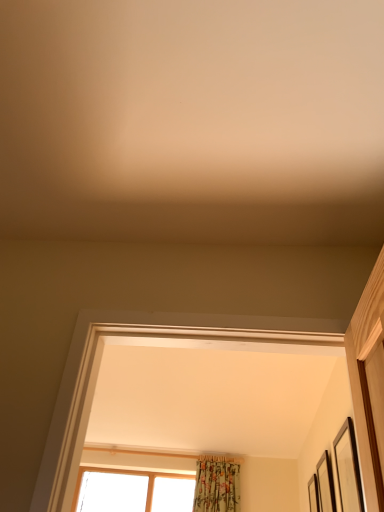
Question: Does wooden picture frame at right, the 2th picture frame when ordered from front to back, have a lesser width compared to black matte picture frame at right, the 3th picture frame in the right-to-left sequence?

Choices:
 (A) no
 (B) yes

Answer: (A)

Question: Can you confirm if wooden picture frame at right, acting as the second picture frame starting from the back, is wider than black matte picture frame at right, which is counted as the third picture frame, starting from the back?

Choices:
 (A) yes
 (B) no

Answer: (A)

Question: Could you tell me if wooden picture frame at right, placed as the 2th picture frame when sorted from left to right, is turned towards black matte picture frame at right, which is counted as the third picture frame, starting from the back?

Choices:
 (A) no
 (B) yes

Answer: (A)

Question: Considering the relative positions of wooden picture frame at right, marked as the 2th picture frame in a right-to-left arrangement, and black matte picture frame at right, the 3th picture frame in the right-to-left sequence, in the image provided, is wooden picture frame at right, marked as the 2th picture frame in a right-to-left arrangement, to the right of black matte picture frame at right, the 3th picture frame in the right-to-left sequence, from the viewer's perspective?

Choices:
 (A) yes
 (B) no

Answer: (A)

Question: Is wooden picture frame at right, placed as the 2th picture frame when sorted from left to right, next to black matte picture frame at right, the first picture frame when ordered from left to right, and touching it?

Choices:
 (A) no
 (B) yes

Answer: (A)

Question: From a real-world perspective, is wooden picture frame at right, marked as the 2th picture frame in a right-to-left arrangement, positioned over black matte picture frame at right, the first picture frame when ordered from left to right, based on gravity?

Choices:
 (A) no
 (B) yes

Answer: (B)

Question: From the image's perspective, is wooden picture frame at right, marked as the 2th picture frame in a right-to-left arrangement, below wooden picture frame at right, the third picture frame when ordered from front to back?

Choices:
 (A) no
 (B) yes

Answer: (A)

Question: Can you confirm if wooden picture frame at right, placed as the 2th picture frame when sorted from left to right, is bigger than wooden picture frame at right, the 3th picture frame viewed from the left?

Choices:
 (A) yes
 (B) no

Answer: (B)

Question: Is wooden picture frame at right, the 2th picture frame when ordered from front to back, smaller than wooden picture frame at right, placed as the first picture frame when sorted from back to front?

Choices:
 (A) no
 (B) yes

Answer: (B)

Question: Is wooden picture frame at right, the second picture frame in the top-to-bottom sequence, further to camera compared to wooden picture frame at right, which ranks as the third picture frame in top-to-bottom order?

Choices:
 (A) yes
 (B) no

Answer: (B)

Question: From the image's perspective, would you say wooden picture frame at right, the second picture frame in the top-to-bottom sequence, is positioned over wooden picture frame at right, placed as the 1th picture frame when sorted from bottom to top?

Choices:
 (A) no
 (B) yes

Answer: (B)

Question: Does wooden picture frame at right, marked as the 2th picture frame in a right-to-left arrangement, touch wooden picture frame at right, the 3th picture frame viewed from the left?

Choices:
 (A) yes
 (B) no

Answer: (B)

Question: Could you tell me if wooden picture frame at right, which ranks as the third picture frame in top-to-bottom order, is turned towards black matte picture frame at right, which is counted as the third picture frame, starting from the back?

Choices:
 (A) no
 (B) yes

Answer: (A)